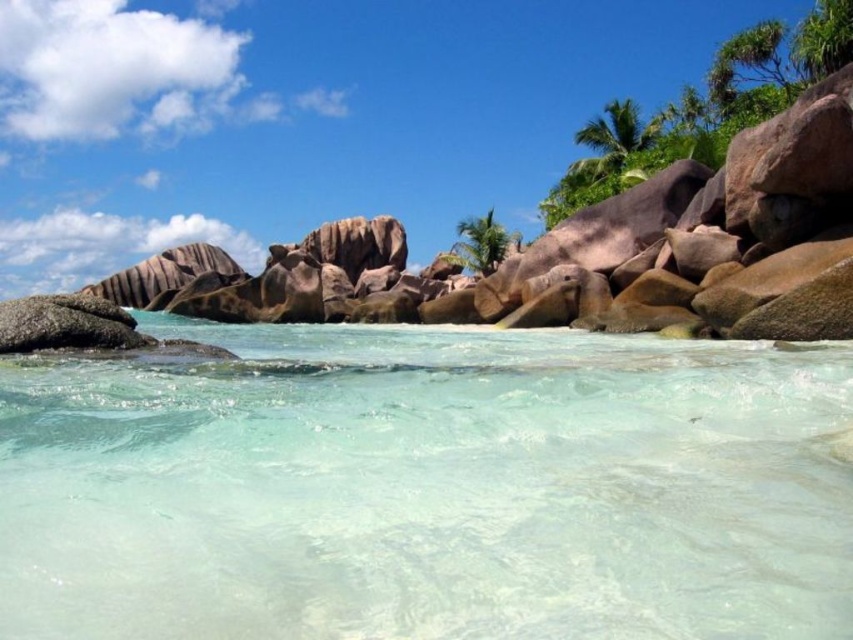
Does brown granite rock formation at upper center appear under green leafy palm tree at center?

Yes, brown granite rock formation at upper center is below green leafy palm tree at center.

Is point (787, 148) farther from viewer compared to point (509, 244)?

No, it is in front of (509, 244).

Find the location of a particular element. Image resolution: width=853 pixels, height=640 pixels. brown granite rock formation at upper center is located at coordinates (618, 250).

Which is in front, point (622, 157) or point (495, 228)?

Point (622, 157) is in front.

Is green leafy palm tree at upper right thinner than green leafy palm tree at center?

No, green leafy palm tree at upper right is not thinner than green leafy palm tree at center.

What do you see at coordinates (613, 145) in the screenshot?
I see `green leafy palm tree at upper right` at bounding box center [613, 145].

Identify the location of green leafy palm tree at upper right. This screenshot has height=640, width=853. (613, 145).

Is brown granite rock formation at upper center to the right of green leafy palm tree at upper right from the viewer's perspective?

Incorrect, brown granite rock formation at upper center is not on the right side of green leafy palm tree at upper right.

Can you confirm if brown granite rock formation at upper center is bigger than green leafy palm tree at upper right?

Yes, brown granite rock formation at upper center is bigger than green leafy palm tree at upper right.

This screenshot has width=853, height=640. I want to click on brown granite rock formation at upper center, so click(618, 250).